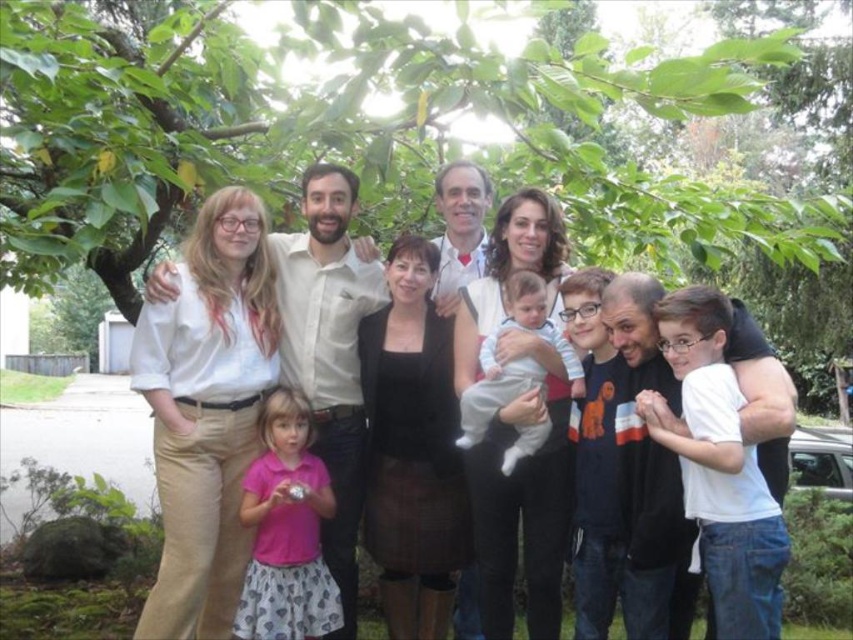
Question: Considering the relative positions of pink fabric dress at lower left and light blue cotton onesie at center in the image provided, where is pink fabric dress at lower left located with respect to light blue cotton onesie at center?

Choices:
 (A) right
 (B) left

Answer: (B)

Question: Does pink fabric dress at lower left have a smaller size compared to light blue cotton onesie at center?

Choices:
 (A) yes
 (B) no

Answer: (B)

Question: Which of the following is the farthest from the observer?

Choices:
 (A) (466, 404)
 (B) (248, 480)

Answer: (B)

Question: Considering the real-world distances, which object is closest to the pink fabric dress at lower left?

Choices:
 (A) green leafy tree at upper center
 (B) matte white shirt at center
 (C) light blue cotton onesie at center

Answer: (B)

Question: Which of the following is the farthest from the observer?

Choices:
 (A) matte white shirt at center
 (B) pink fabric dress at lower left
 (C) green leafy tree at upper center
 (D) light blue cotton onesie at center

Answer: (A)

Question: Is matte white shirt at center bigger than pink fabric dress at lower left?

Choices:
 (A) yes
 (B) no

Answer: (A)